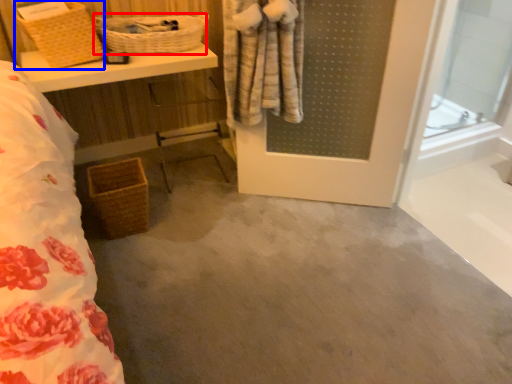
Question: Among these objects, which one is farthest to the camera, basket (highlighted by a red box) or basket (highlighted by a blue box)?

Choices:
 (A) basket
 (B) basket

Answer: (A)